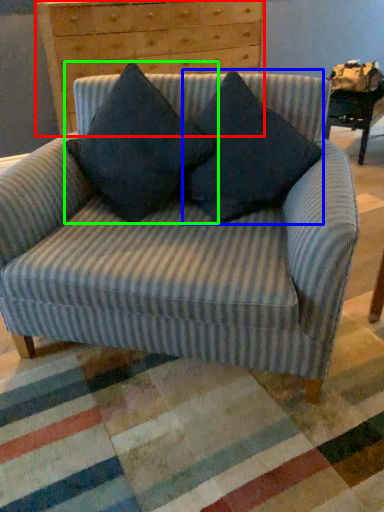
Question: Considering the real-world distances, which object is closest to chest of drawers (highlighted by a red box)? pillow (highlighted by a blue box) or pillow (highlighted by a green box).

Choices:
 (A) pillow
 (B) pillow

Answer: (B)